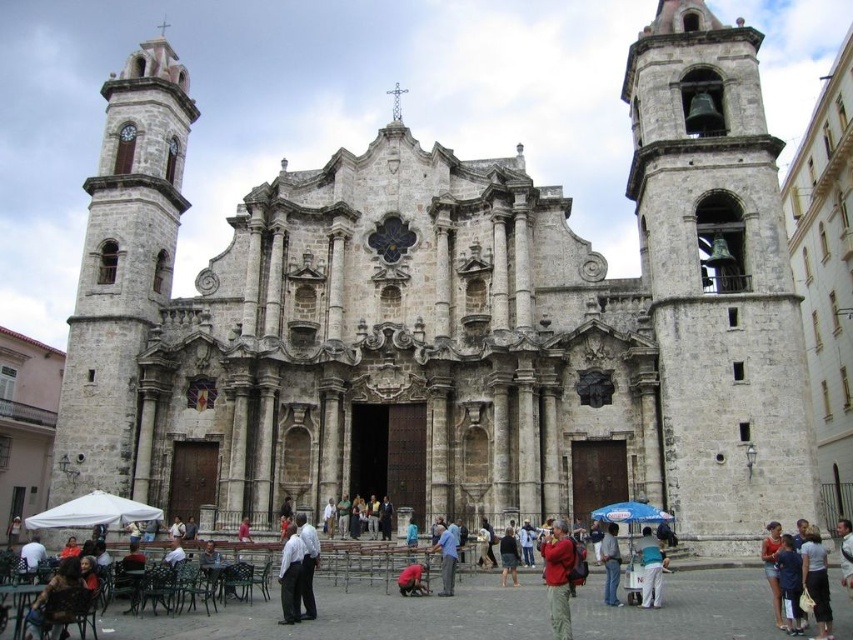
Is dark blue shirt at center smaller than light blue fabric umbrella at center?

Yes, dark blue shirt at center is smaller than light blue fabric umbrella at center.

Is dark blue shirt at center closer to the viewer compared to light blue fabric umbrella at center?

Yes, it is.

Is point (817, 564) positioned before point (641, 529)?

That is True.

Identify the location of dark blue shirt at center. (816, 580).

Does dark brown leather jacket at lower left appear over red fabric jacket at center?

No, dark brown leather jacket at lower left is not above red fabric jacket at center.

Which is more to the right, dark brown leather jacket at lower left or red fabric jacket at center?

From the viewer's perspective, red fabric jacket at center appears more on the right side.

This screenshot has height=640, width=853. I want to click on dark brown leather jacket at lower left, so click(56, 602).

Does matte gray shirt at center have a smaller size compared to pink fabric at center?

Incorrect, matte gray shirt at center is not smaller in size than pink fabric at center.

Who is lower down, matte gray shirt at center or pink fabric at center?

pink fabric at center is lower down.

Locate an element on the screen. Image resolution: width=853 pixels, height=640 pixels. matte gray shirt at center is located at coordinates (357, 515).

Locate an element on the screen. The width and height of the screenshot is (853, 640). matte gray shirt at center is located at coordinates [357, 515].